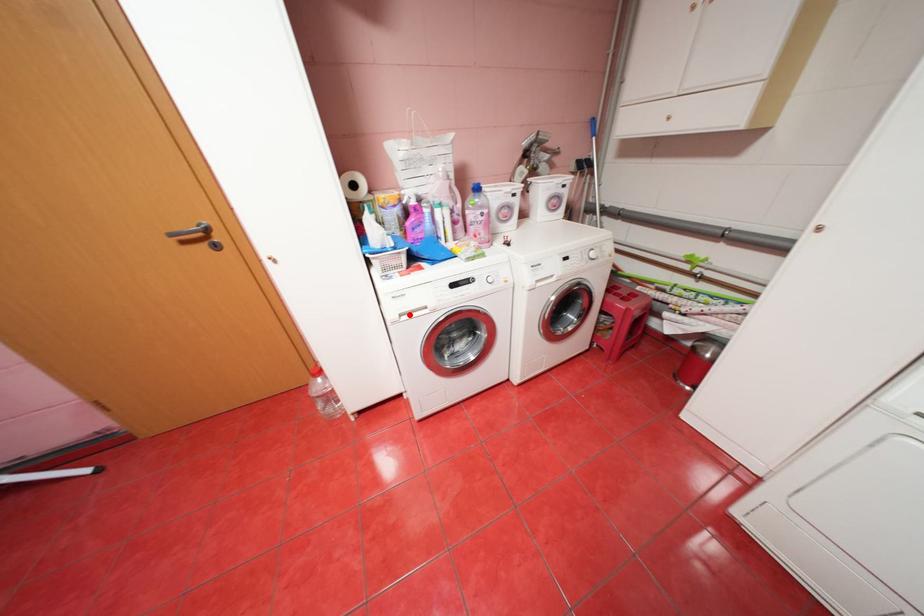
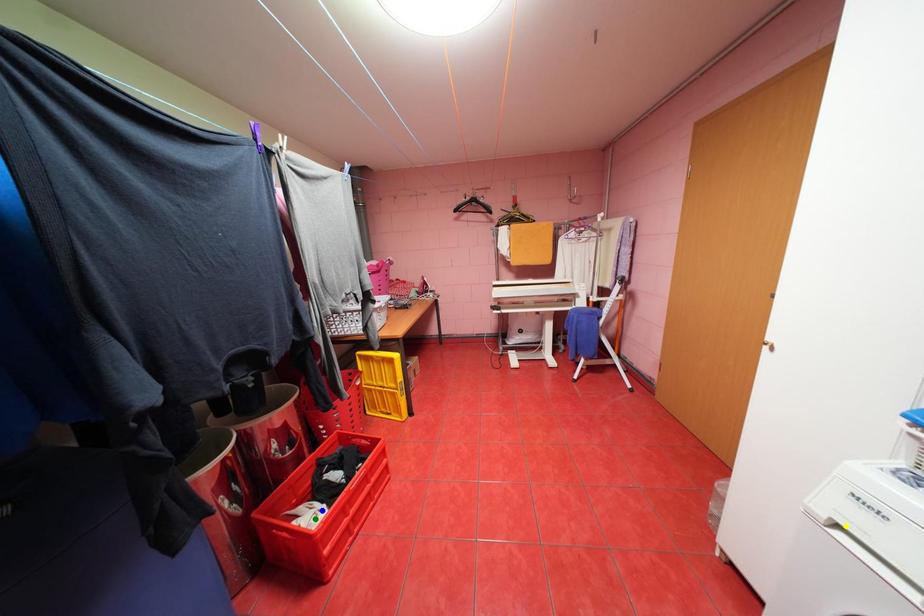
Question: I am providing you with two images of the same scene from different viewpoints. A red point is marked on the first image. You are given multiple points on the second image. In image 2, which mark is for the same physical point as the one in image 1?

Choices:
 (A) blue point
 (B) yellow point
 (C) green point

Answer: (B)